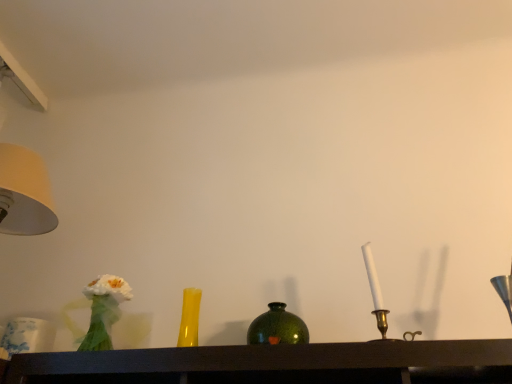
Question: Should I look upward or downward to see matte yellow glass vase at center?

Choices:
 (A) up
 (B) down

Answer: (B)

Question: Can you confirm if green glass vase at center is taller than matte yellow glass vase at center?

Choices:
 (A) yes
 (B) no

Answer: (B)

Question: Is green glass vase at center to the left of matte yellow glass vase at center from the viewer's perspective?

Choices:
 (A) yes
 (B) no

Answer: (B)

Question: From the image's perspective, is green glass vase at center located above matte yellow glass vase at center?

Choices:
 (A) yes
 (B) no

Answer: (B)

Question: Is green glass vase at center to the right of matte yellow glass vase at center from the viewer's perspective?

Choices:
 (A) no
 (B) yes

Answer: (B)

Question: Does green glass vase at center have a lesser width compared to matte yellow glass vase at center?

Choices:
 (A) yes
 (B) no

Answer: (A)

Question: Can you confirm if green glass vase at center is shorter than matte yellow glass vase at center?

Choices:
 (A) yes
 (B) no

Answer: (A)

Question: Are green glass vase at center and white fabric flower at left far apart?

Choices:
 (A) yes
 (B) no

Answer: (B)

Question: Considering the relative sizes of green glass vase at center and white fabric flower at left in the image provided, is green glass vase at center shorter than white fabric flower at left?

Choices:
 (A) yes
 (B) no

Answer: (A)

Question: Could you tell me if green glass vase at center is turned towards white fabric flower at left?

Choices:
 (A) no
 (B) yes

Answer: (A)

Question: Does green glass vase at center have a greater width compared to white fabric flower at left?

Choices:
 (A) yes
 (B) no

Answer: (B)

Question: From the image's perspective, is green glass vase at center under white fabric flower at left?

Choices:
 (A) yes
 (B) no

Answer: (A)

Question: Can you confirm if green glass vase at center is smaller than white fabric flower at left?

Choices:
 (A) no
 (B) yes

Answer: (B)

Question: Is white fabric flower at left thinner than matte yellow glass vase at center?

Choices:
 (A) no
 (B) yes

Answer: (A)